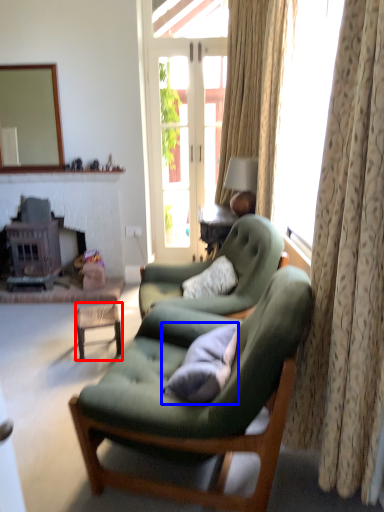
Question: Among these objects, which one is nearest to the camera, table (highlighted by a red box) or pillow (highlighted by a blue box)?

Choices:
 (A) table
 (B) pillow

Answer: (B)